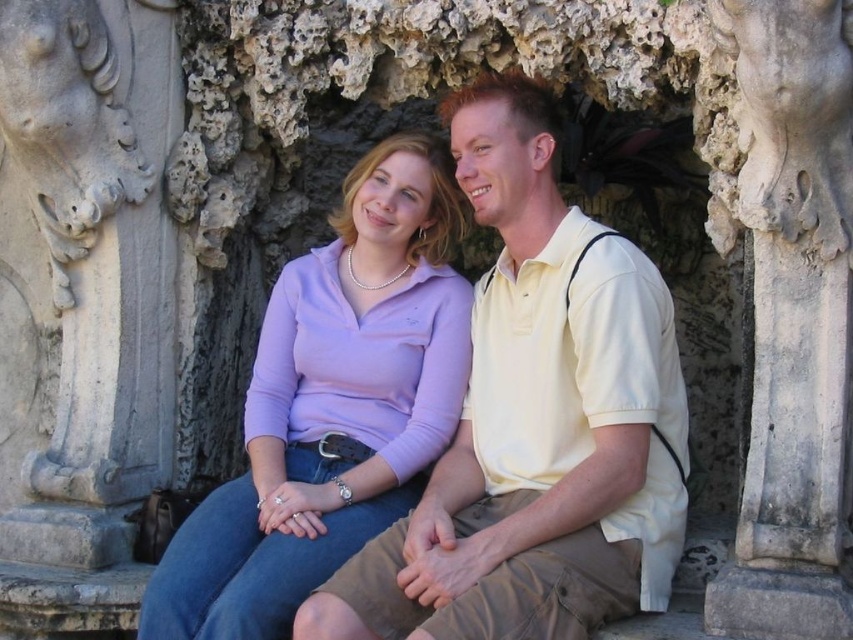
Which is more to the left, matte purple shirt at center or white stone carving at center?

matte purple shirt at center is more to the left.

Between matte purple shirt at center and white stone carving at center, which one is positioned higher?

white stone carving at center is higher up.

Who is more distant from viewer, (393,186) or (804,534)?

Point (393,186)

Locate an element on the screen. matte purple shirt at center is located at coordinates (331, 404).

Which is below, matte yellow shirt at center or matte purple shirt at center?

Positioned lower is matte purple shirt at center.

Is point (578, 243) behind point (291, 378)?

No, (578, 243) is in front of (291, 378).

This screenshot has width=853, height=640. What are the coordinates of `matte yellow shirt at center` in the screenshot? It's located at (535, 420).

Is matte yellow shirt at center below white stone carving at center?

Yes, matte yellow shirt at center is below white stone carving at center.

Which is in front, point (550, 317) or point (762, 163)?

Point (762, 163)

Who is more distant from viewer, (x=428, y=566) or (x=846, y=205)?

The point (x=846, y=205) is more distant.

Identify the location of matte yellow shirt at center. (535, 420).